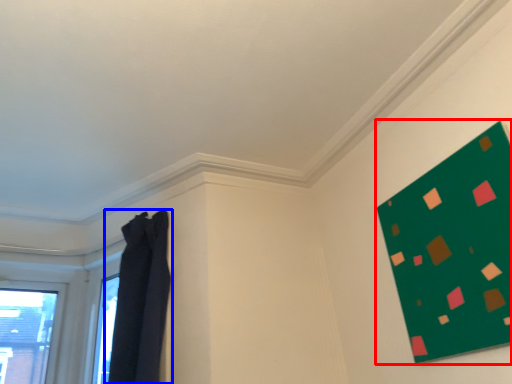
Question: Which of the following is the farthest to the observer, bulletin board (highlighted by a red box) or curtain (highlighted by a blue box)?

Choices:
 (A) bulletin board
 (B) curtain

Answer: (B)